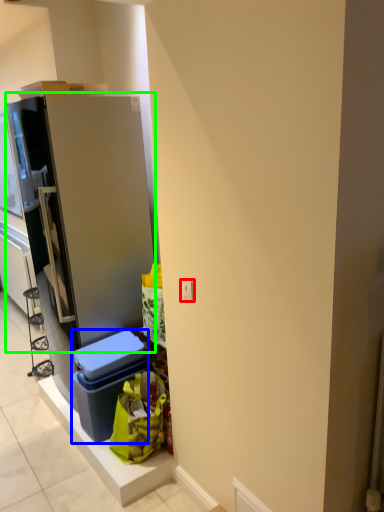
Question: Which object is the farthest from electric outlet (highlighted by a red box)? Choose among these: storage box (highlighted by a blue box) or refrigerator (highlighted by a green box).

Choices:
 (A) storage box
 (B) refrigerator

Answer: (B)